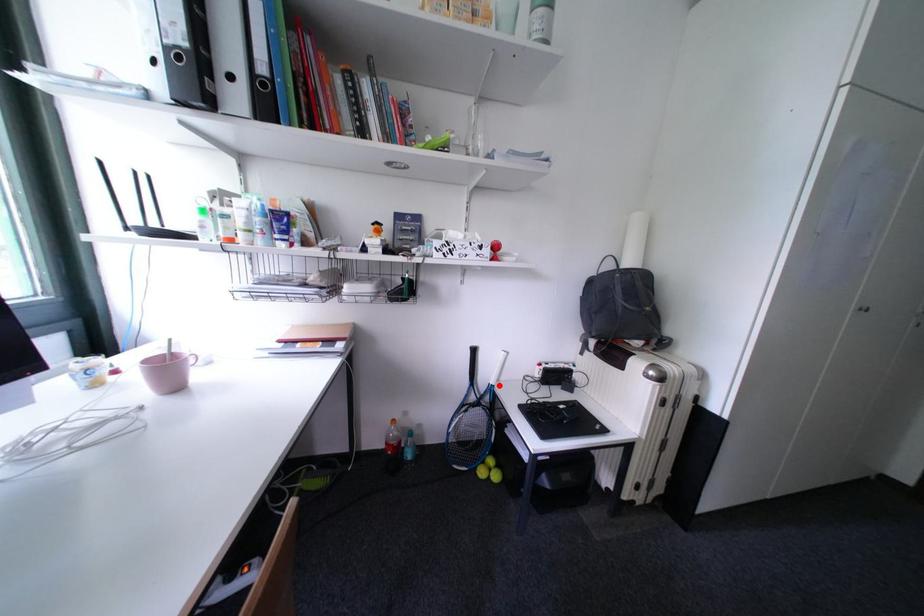
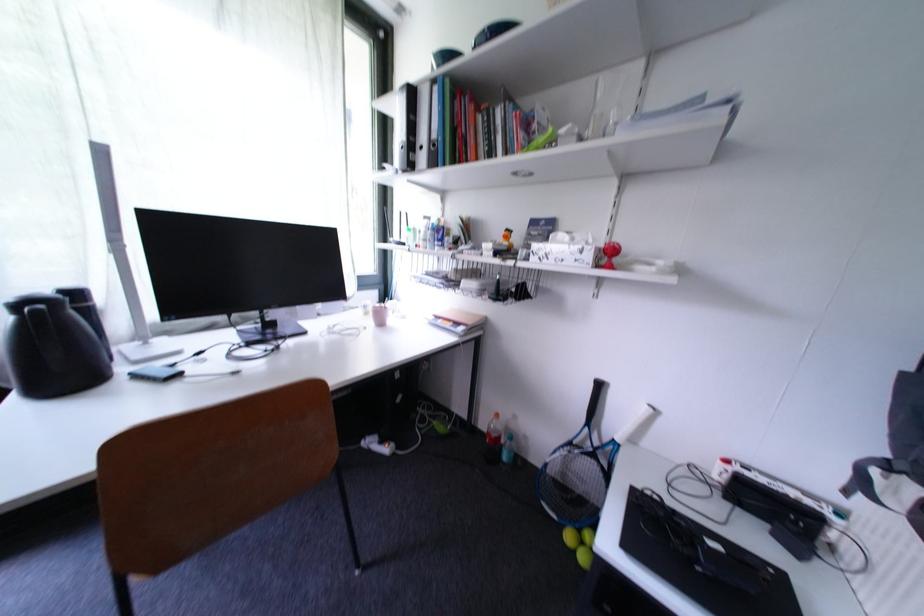
In the second image, find the point that corresponds to the highlighted location in the first image.

(625, 440)